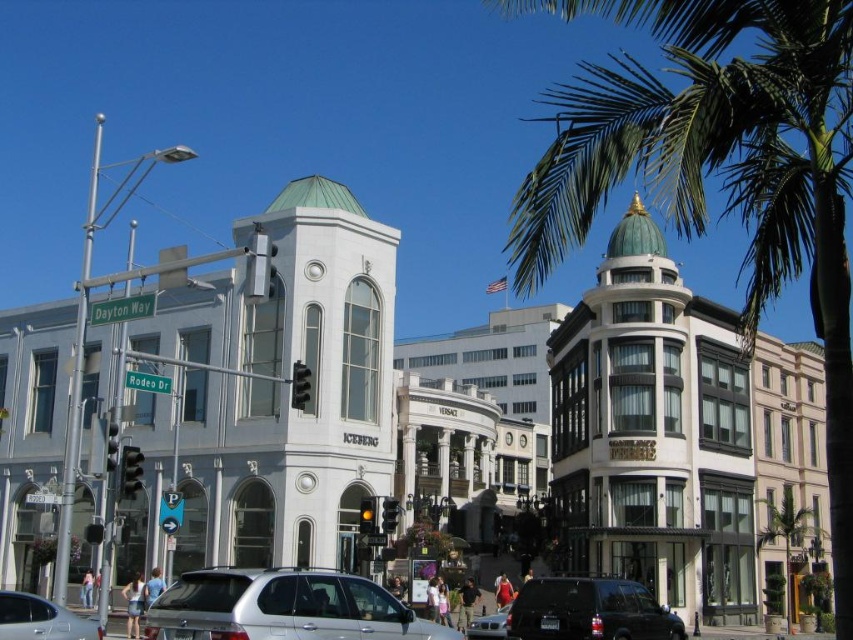
Can you confirm if green leafy palm tree at upper right is smaller than silver metallic car at lower left?

Incorrect, green leafy palm tree at upper right is not smaller in size than silver metallic car at lower left.

Which is more to the left, green leafy palm tree at upper right or silver metallic car at lower left?

silver metallic car at lower left is more to the left.

This screenshot has width=853, height=640. In order to click on green leafy palm tree at upper right in this screenshot , I will do `click(718, 170)`.

Between green leafy palm tree at upper right and silver metallic sedan at center, which one appears on the left side from the viewer's perspective?

silver metallic sedan at center is more to the left.

Identify the location of green leafy palm tree at upper right. This screenshot has width=853, height=640. (718, 170).

The image size is (853, 640). In order to click on green leafy palm tree at upper right in this screenshot , I will do `click(718, 170)`.

Between green leafy palm tree at center right and silver metallic sedan at center, which one has more height?

Standing taller between the two is green leafy palm tree at center right.

This screenshot has width=853, height=640. What do you see at coordinates (784, 538) in the screenshot? I see `green leafy palm tree at center right` at bounding box center [784, 538].

Does point (788, 586) come closer to viewer compared to point (503, 620)?

No, it is behind (503, 620).

Locate an element on the screen. This screenshot has width=853, height=640. green leafy palm tree at center right is located at coordinates (784, 538).